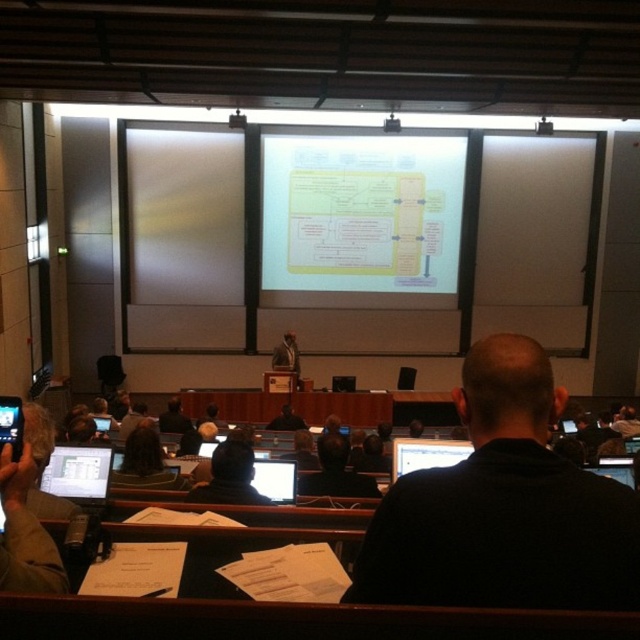
Between white glossy projector screen at center and matte black laptop at lower left, which one is positioned higher?

white glossy projector screen at center is higher up.

In the scene shown: Is white glossy projector screen at center smaller than matte black laptop at lower left?

No.

Describe the element at coordinates (362, 220) in the screenshot. I see `white glossy projector screen at center` at that location.

At what (x,y) coordinates should I click in order to perform the action: click on white glossy projector screen at center. Please return your answer as a coordinate pair (x, y). Image resolution: width=640 pixels, height=640 pixels. Looking at the image, I should click on (362, 220).

Is matte black laptop at lower left to the right of matte black laptop at upper center from the viewer's perspective?

In fact, matte black laptop at lower left is to the left of matte black laptop at upper center.

Who is more distant from viewer, (83, 458) or (442, 451)?

The point (442, 451) is behind.

Who is more forward, (60, 464) or (406, 461)?

Point (60, 464) is more forward.

This screenshot has width=640, height=640. Identify the location of matte black laptop at lower left. (77, 472).

Is point (51, 461) farther from camera compared to point (337, 490)?

That is False.

Is point (61, 467) positioned before point (339, 486)?

That is True.

Does point (77, 490) come closer to viewer compared to point (332, 444)?

Yes, it is.

Where is `matte black laptop at lower left`? matte black laptop at lower left is located at coordinates (77, 472).